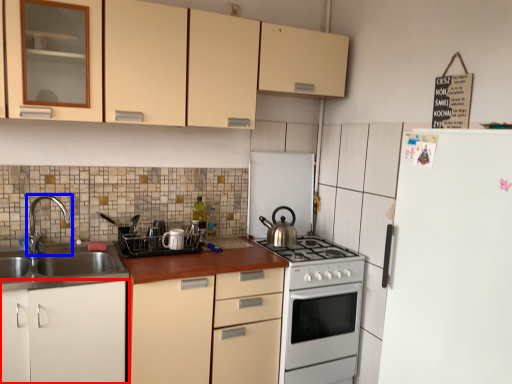
Question: Which point is closer to the camera, cabinetry (highlighted by a red box) or tap (highlighted by a blue box)?

Choices:
 (A) cabinetry
 (B) tap

Answer: (A)